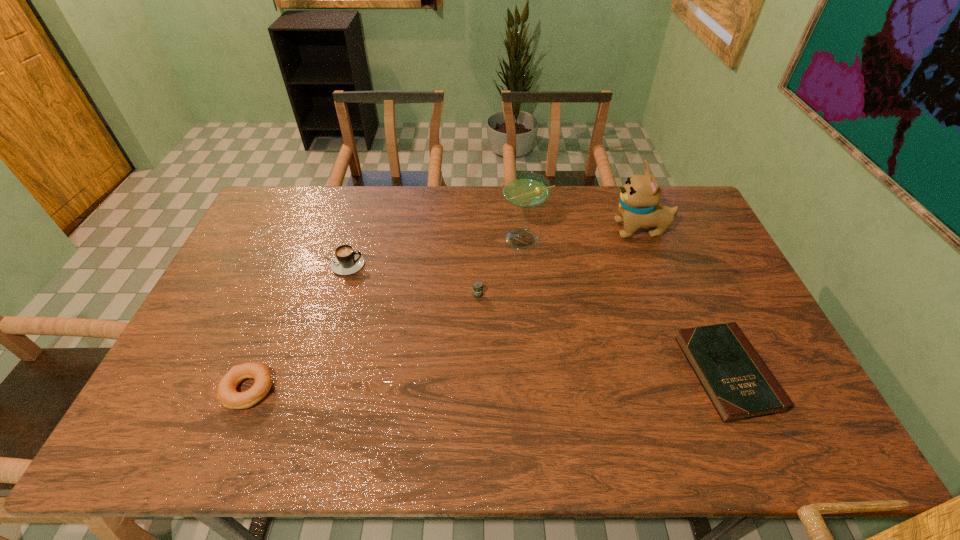
The image size is (960, 540). Find the location of `vacant space located 0.070m on the right of the martini`. vacant space located 0.070m on the right of the martini is located at coordinates (568, 240).

Locate an element on the screen. This screenshot has height=540, width=960. vacant space located 0.120m with the handle on the side of the cappuccino is located at coordinates (402, 265).

This screenshot has height=540, width=960. Find the location of `vacant space located on the front of the beer can`. vacant space located on the front of the beer can is located at coordinates (477, 427).

Where is `free region located 0.110m on the left of the bagel`? This screenshot has width=960, height=540. free region located 0.110m on the left of the bagel is located at coordinates (179, 389).

The width and height of the screenshot is (960, 540). What are the coordinates of `vacant space situated 0.340m on the left of the Bible` in the screenshot? It's located at (555, 373).

Where is `puppy that is at the far edge`? puppy that is at the far edge is located at coordinates (639, 206).

Identify the location of martini that is at the far edge. (526, 190).

Where is `object present at the near edge`? object present at the near edge is located at coordinates (740, 386).

Identify the location of object located in the left edge section of the desktop. (226, 393).

You are a GUI agent. You are given a task and a screenshot of the screen. Output one action in this format:
    pyautogui.click(x=<x>, y=<y>)
    Task: Click on the puppy present at the right edge
    
    Given the screenshot: What is the action you would take?
    pyautogui.click(x=639, y=206)